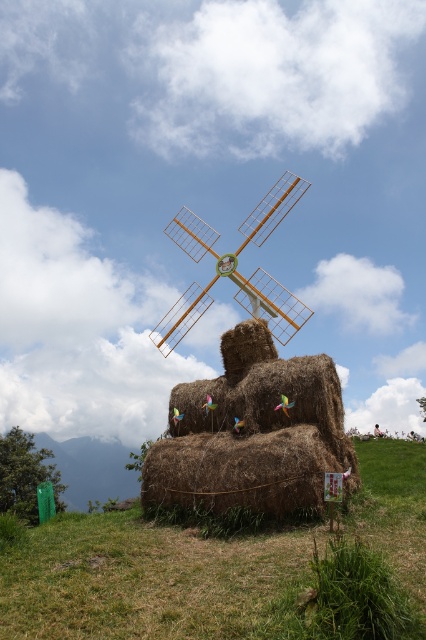
You are a gardener planning to plant flowers around the brown grassy at center and the wooden windmill at center. Which area requires more space for planting?

The wooden windmill at center requires more space for planting around it because the brown grassy at center occupies less space than the wooden windmill at center.

You are standing in the outdoor scene and want to place a new decorative item. If you want to place it on the ground near the wooden windmill at center, where should you place it relative to the brown grassy at center?

Since the brown grassy at center is positioned under the wooden windmill at center, placing the new decorative item on the ground near the wooden windmill at center would mean placing it on the brown grassy at center.

Based on the photo, you are standing in front of the hay sculpture and want to reach a point that is 8.88 meters away from your current position. The point is marked as point (x=396, y=577) in the image. Can you estimate whether this point is closer to the hay sculpture or the windmill on top of it?

The point (x=396, y=577) is 8.88 meters from the camera. Since the windmill is on top of the hay sculpture, the point is likely closer to the windmill than the base sculpture.